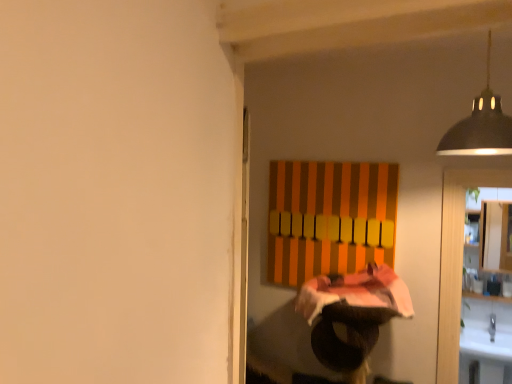
Question: Does black metal lampshade at upper right contain white glossy cabinet at right?

Choices:
 (A) yes
 (B) no

Answer: (B)

Question: Can you confirm if black metal lampshade at upper right is positioned to the left of white glossy cabinet at right?

Choices:
 (A) no
 (B) yes

Answer: (B)

Question: Is black metal lampshade at upper right thinner than white glossy cabinet at right?

Choices:
 (A) no
 (B) yes

Answer: (A)

Question: Could you tell me if black metal lampshade at upper right is turned towards white glossy cabinet at right?

Choices:
 (A) no
 (B) yes

Answer: (B)

Question: Considering the relative sizes of black metal lampshade at upper right and white glossy cabinet at right in the image provided, is black metal lampshade at upper right bigger than white glossy cabinet at right?

Choices:
 (A) yes
 (B) no

Answer: (B)

Question: Is black metal lampshade at upper right far away from white glossy cabinet at right?

Choices:
 (A) yes
 (B) no

Answer: (A)

Question: From a real-world perspective, is white glossy cabinet at right on black metal lampshade at upper right?

Choices:
 (A) no
 (B) yes

Answer: (A)

Question: Is white glossy cabinet at right beside black metal lampshade at upper right?

Choices:
 (A) yes
 (B) no

Answer: (B)

Question: Considering the relative sizes of white glossy cabinet at right and black metal lampshade at upper right in the image provided, is white glossy cabinet at right smaller than black metal lampshade at upper right?

Choices:
 (A) yes
 (B) no

Answer: (B)

Question: Is white glossy cabinet at right closer to the viewer compared to black metal lampshade at upper right?

Choices:
 (A) yes
 (B) no

Answer: (B)

Question: From the image's perspective, would you say white glossy cabinet at right is positioned over black metal lampshade at upper right?

Choices:
 (A) yes
 (B) no

Answer: (B)

Question: Considering the relative sizes of white glossy cabinet at right and black metal lampshade at upper right in the image provided, is white glossy cabinet at right thinner than black metal lampshade at upper right?

Choices:
 (A) yes
 (B) no

Answer: (A)

Question: In terms of height, does black metal lampshade at upper right look taller or shorter compared to white glossy cabinet at right?

Choices:
 (A) short
 (B) tall

Answer: (A)